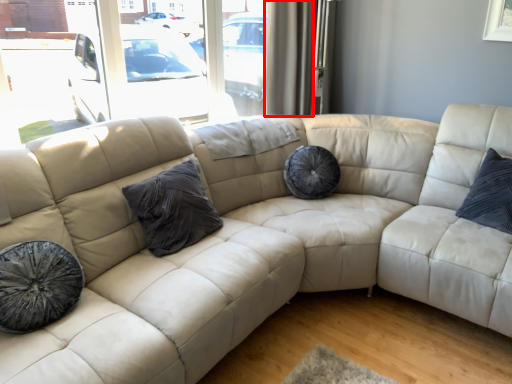
Question: From the image's perspective, where is curtain (annotated by the red box) located in relation to pillow in the image?

Choices:
 (A) below
 (B) above

Answer: (B)